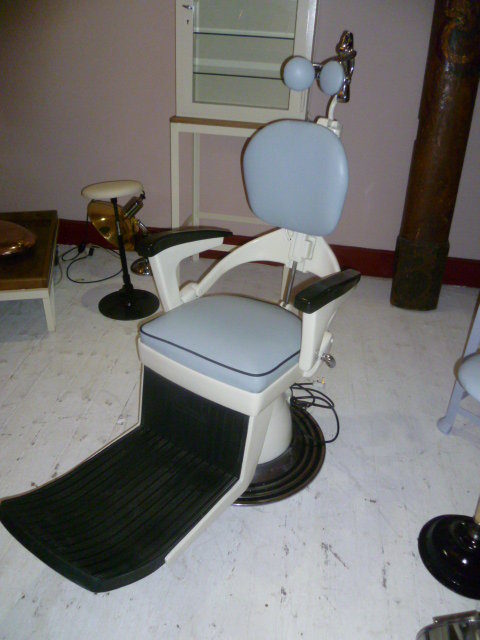
What are the coordinates of `floor` in the screenshot? It's located at (348, 512).